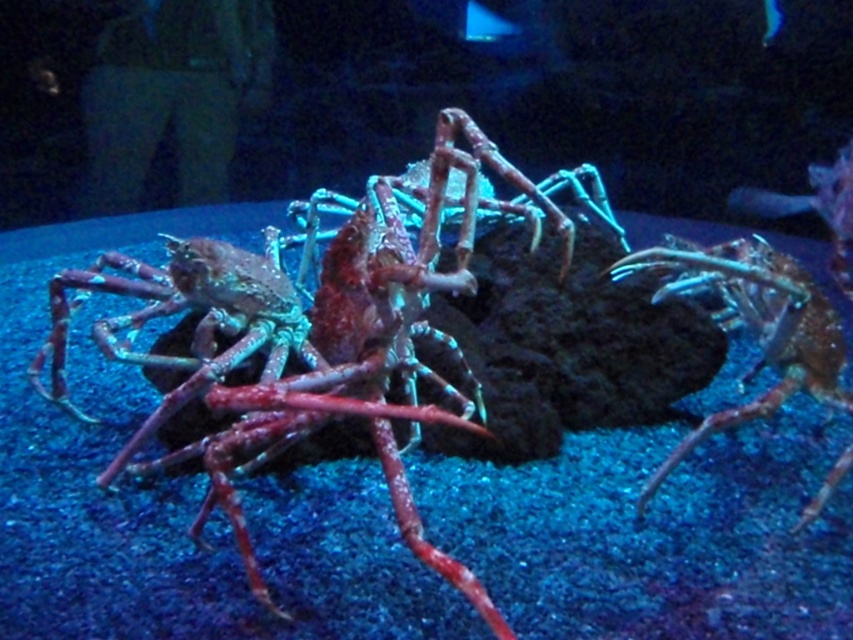
You are designing an aquarium tank and need to ensure that the shiny red crab at center and the shiny metallic crab claw at center can both fit through a narrow opening. Based on their sizes, which one is more likely to fit through the opening?

The shiny metallic crab claw at center is narrower than the shiny red crab at center, so it is more likely to fit through the narrow opening.

You are an aquarium maintenance worker who needs to place a 60 cm long maintenance tool between the shiny red crab at center and the shiny metallic crab claw at center. Can you fit the tool in the space between them without touching either?

The distance between the shiny red crab at center and the shiny metallic crab claw at center is 67.07 centimeters. Since the tool is 60 cm long, it can fit in the space as the distance is greater than the tool length.